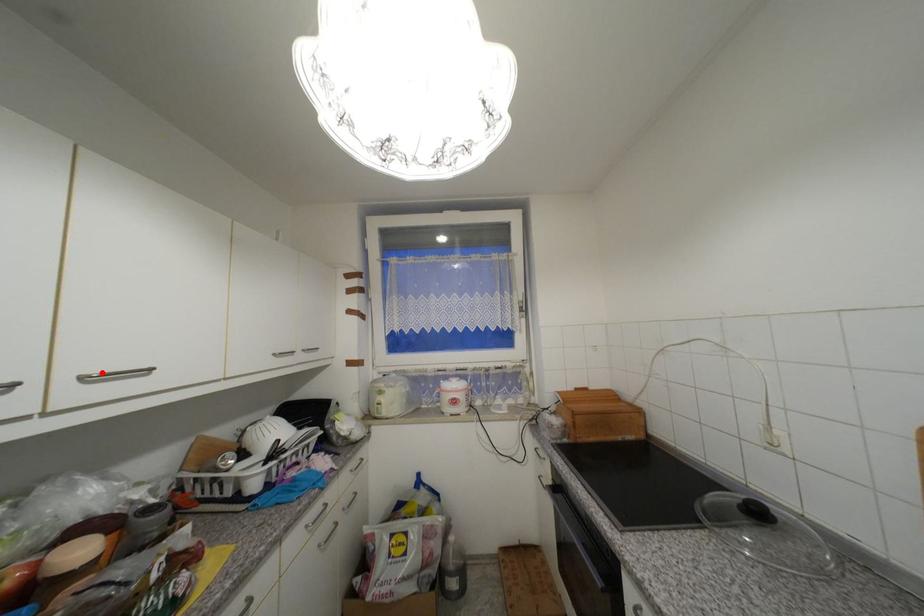
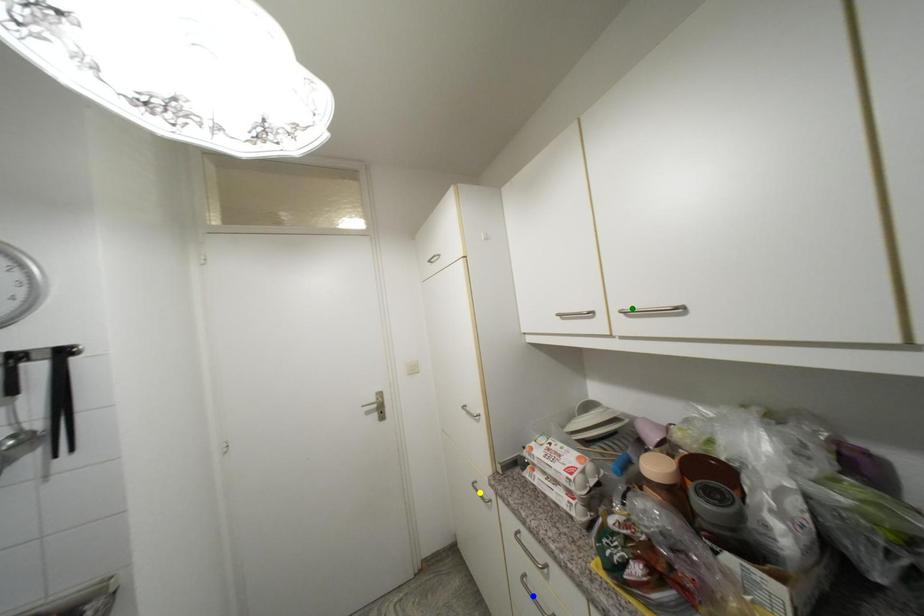
Question: I am providing you with two images of the same scene from different viewpoints. A red point is marked on the first image. You are given multiple points on the second image. Which point in image 2 represents the same 3d spot as the red point in image 1?

Choices:
 (A) green point
 (B) yellow point
 (C) blue point

Answer: (A)